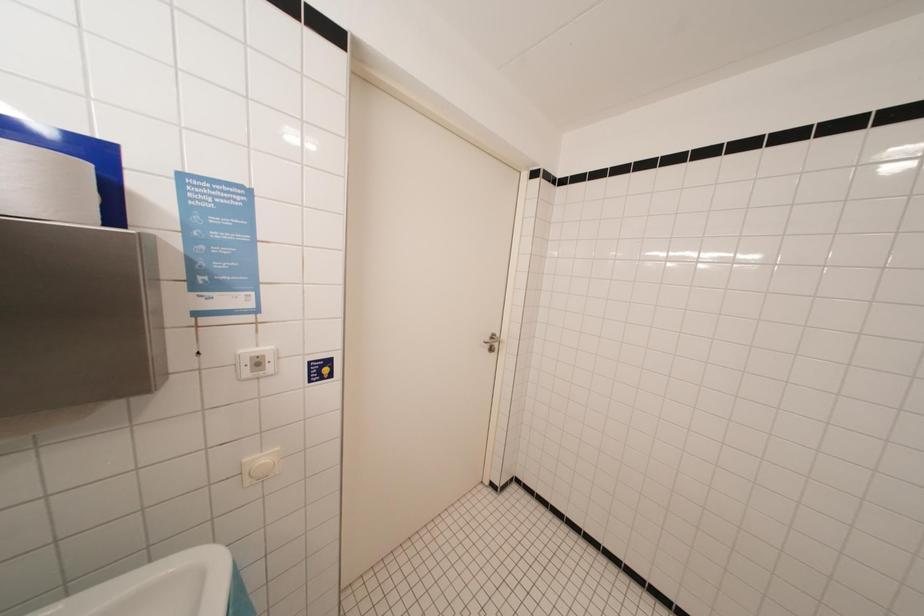
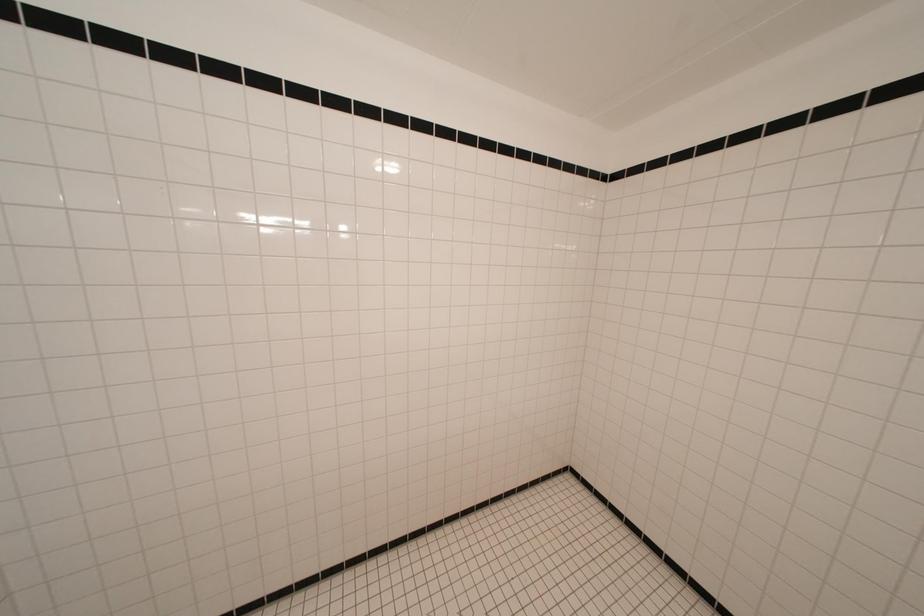
Question: The camera is either moving clockwise (left) or counter-clockwise (right) around the object. The first image is from the beginning of the video and the second image is from the end. Is the camera moving left or right when shooting the video?

Choices:
 (A) Left
 (B) Right

Answer: (A)